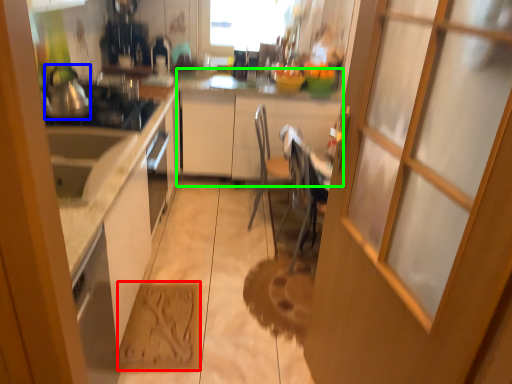
Question: Considering the real-world distances, which object is closest to cardboard (highlighted by a red box)? tea pot (highlighted by a blue box) or cabinetry (highlighted by a green box).

Choices:
 (A) tea pot
 (B) cabinetry

Answer: (A)